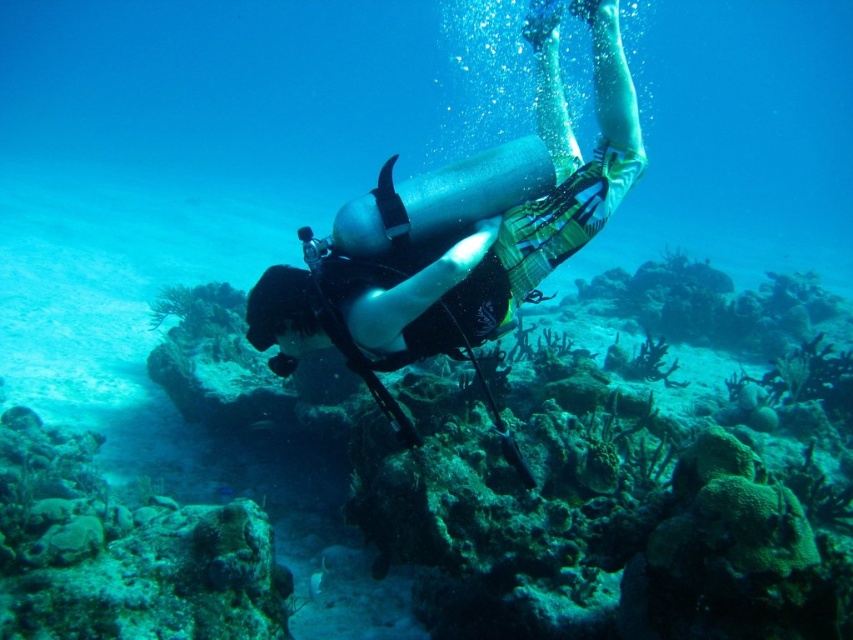
Question: Is green coral reef at center thinner than silver metallic scuba diver at center?

Choices:
 (A) no
 (B) yes

Answer: (A)

Question: Is green coral reef at center closer to camera compared to silver metallic scuba diver at center?

Choices:
 (A) no
 (B) yes

Answer: (A)

Question: Which point is farther to the camera?

Choices:
 (A) green coral reef at center
 (B) silver metallic scuba diver at center

Answer: (A)

Question: Does green coral reef at center appear over silver metallic scuba diver at center?

Choices:
 (A) no
 (B) yes

Answer: (A)

Question: Which point is farther to the camera?

Choices:
 (A) silver metallic scuba diver at center
 (B) green coral reef at center

Answer: (B)